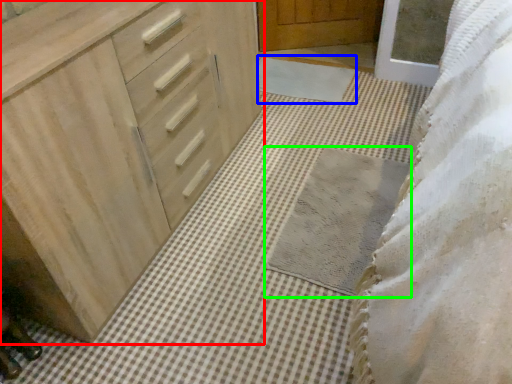
Question: Estimate the real-world distances between objects in this image. Which object is closer to chest of drawers (highlighted by a red box), bath mat (highlighted by a blue box) or bath mat (highlighted by a green box)?

Choices:
 (A) bath mat
 (B) bath mat

Answer: (B)